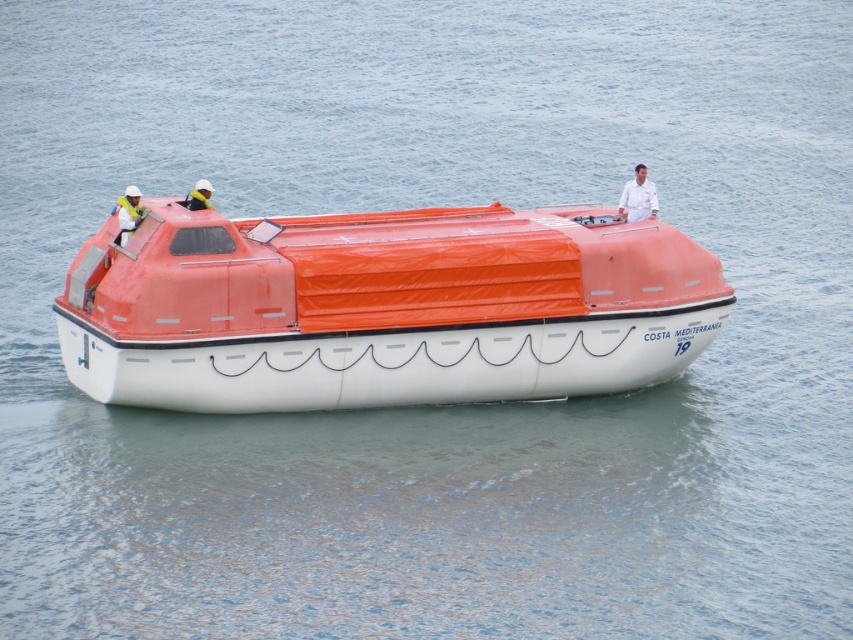
You are a passenger on the COSTA MEDITERRANEA and need to store your white matte life vest at left in the orange matte lifeboat at center. Can you fit it inside based on their sizes?

Result: The orange matte lifeboat at center might be wider than white matte life vest at left, so it is likely possible to fit the white matte life vest at left inside the orange matte lifeboat at center.

You are a passenger on the COSTA MEDITERRANEA lifeboat and need to locate your belongings. You see a white matte shirt at upper center and a yellow life vest at upper center. Which item is covering the other?

The white matte shirt at upper center is positioned over the yellow life vest at upper center, so the white matte shirt is covering the yellow life vest.

In the scene shown: You are standing on the deck of the COSTA MEDITERRANEA and looking down at the orange matte lifeboat at center and the white matte life vest at left. Which object is taller?

The orange matte lifeboat at center is much taller than the white matte life vest at left.